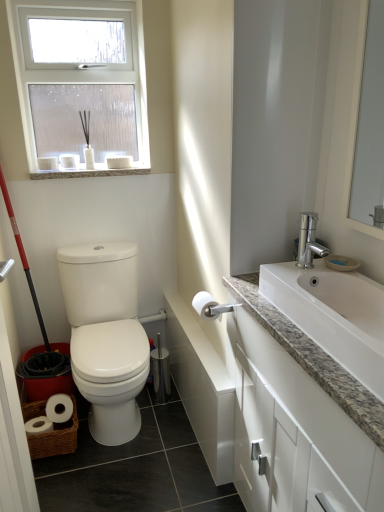
The height and width of the screenshot is (512, 384). Describe the element at coordinates (81, 68) in the screenshot. I see `white frosted glass window at upper left` at that location.

This screenshot has height=512, width=384. Describe the element at coordinates (331, 308) in the screenshot. I see `white granite sink at right` at that location.

In order to face white granite countertop at right, should I rotate leftwards or rightwards?

To align with it, rotate right about 17.324°.

You are a GUI agent. You are given a task and a screenshot of the screen. Output one action in this format:
    pyautogui.click(x=<x>, y=<y>)
    Task: Click on the white glossy toilet at left
    
    Given the screenshot: What is the action you would take?
    pyautogui.click(x=106, y=336)

The width and height of the screenshot is (384, 512). Find the location of `white frosted glass window at upper left`. white frosted glass window at upper left is located at coordinates (81, 68).

From the image's perspective, which one is positioned lower, white glossy mirror at upper right or white granite sink at right?

white granite sink at right appears lower in the image.

Between point (358, 72) and point (373, 314), which one is positioned in front?

The point (373, 314) is in front.

Would you say white granite sink at right is part of white glossy mirror at upper right's contents?

No, white granite sink at right is located outside of white glossy mirror at upper right.

Considering the relative sizes of white glossy mirror at upper right and white granite sink at right in the image provided, is white glossy mirror at upper right taller than white granite sink at right?

Yes, white glossy mirror at upper right is taller than white granite sink at right.

From a real-world perspective, is white glossy mirror at upper right under red plastic screen door at left?

Incorrect, from a real-world perspective, white glossy mirror at upper right is higher than red plastic screen door at left.

Does white glossy mirror at upper right have a larger size compared to red plastic screen door at left?

No, white glossy mirror at upper right is not bigger than red plastic screen door at left.

Where is `screen door below the white glossy mirror at upper right (from the image's perspective)`? screen door below the white glossy mirror at upper right (from the image's perspective) is located at coordinates (13, 438).

Does white glossy toilet at left appear on the right side of granite at upper left?

Correct, you'll find white glossy toilet at left to the right of granite at upper left.

Which of these two, white glossy toilet at left or granite at upper left, is smaller?

granite at upper left.

From the image's perspective, is white glossy toilet at left above granite at upper left?

Actually, white glossy toilet at left appears below granite at upper left in the image.

Is white granite countertop at right to the right of white matte toilet paper at upper right from the viewer's perspective?

Yes.

From the image's perspective, who appears lower, white granite countertop at right or white matte toilet paper at upper right?

white granite countertop at right appears lower in the image.

Is white granite countertop at right turned away from white matte toilet paper at upper right?

No.

Can you confirm if white granite countertop at right is bigger than white matte toilet paper at upper right?

Correct, white granite countertop at right is larger in size than white matte toilet paper at upper right.

From the image's perspective, would you say granite at upper left is positioned over white glossy toilet at left?

Yes, from the image's perspective, granite at upper left is above white glossy toilet at left.

Is white glossy toilet at left at the back of granite at upper left?

granite at upper left does not have its back to white glossy toilet at left.

Which is less distant, (143, 170) or (129, 310)?

Positioned in front is point (129, 310).

Is white glossy toilet at left oriented away from white granite sink at right?

No.

Relative to white granite sink at right, is white glossy toilet at left in front or behind?

white glossy toilet at left is positioned farther from the viewer than white granite sink at right.

Can you tell me how much white glossy toilet at left and white granite sink at right differ in facing direction?

white glossy toilet at left and white granite sink at right are facing 92.4 degrees away from each other.

Does white matte toilet paper at upper right touch white granite sink at right?

No, white matte toilet paper at upper right is not with white granite sink at right.

From a real-world perspective, does white matte toilet paper at upper right sit lower than white granite sink at right?

Correct, in the physical world, white matte toilet paper at upper right is lower than white granite sink at right.

Is white matte toilet paper at upper right positioned with its back to white granite sink at right?

That's not correct — white matte toilet paper at upper right is not looking away from white granite sink at right.

Locate an element on the screen. The height and width of the screenshot is (512, 384). toilet paper lying below the white granite sink at right (from the image's perspective) is located at coordinates (205, 305).

The image size is (384, 512). What are the coordinates of `mirror behind the white granite sink at right` in the screenshot? It's located at (368, 129).

Find the location of a particular element. The image size is (384, 512). mirror on the right of red plastic screen door at left is located at coordinates (368, 129).

Based on their spatial positions, is white granite countertop at right or white glossy toilet paper at center further from granite at upper left?

white granite countertop at right is further to granite at upper left.

When comparing their distances from white granite sink at right, does white frosted glass window at upper left or white matte toilet paper at upper right seem further?

Among the two, white frosted glass window at upper left is located further to white granite sink at right.

When comparing their distances from white glossy mirror at upper right, does red plastic screen door at left or white granite countertop at right seem further?

The object further to white glossy mirror at upper right is red plastic screen door at left.

Considering their positions, is white matte toilet paper at upper right positioned closer to white granite countertop at right than white frosted glass window at upper left?

white matte toilet paper at upper right lies closer to white granite countertop at right than the other object.

Which object lies further to the anchor point white matte toilet paper at upper right, red plastic screen door at left or white granite sink at right?

The object further to white matte toilet paper at upper right is red plastic screen door at left.

Considering their positions, is white matte toilet paper at upper right positioned closer to granite at upper left than white glossy toilet paper at center?

The object closer to granite at upper left is white matte toilet paper at upper right.

Estimate the real-world distances between objects in this image. Which object is further from white granite sink at right, woven brown basket at lower left or white glossy mirror at upper right?

The object further to white granite sink at right is woven brown basket at lower left.

Estimate the real-world distances between objects in this image. Which object is further from white granite countertop at right, red plastic screen door at left or woven brown basket at lower left?

woven brown basket at lower left.

I want to click on toilet positioned between red plastic screen door at left and white frosted glass window at upper left from near to far, so click(106, 336).

Locate an element on the screen. The height and width of the screenshot is (512, 384). toilet paper between white granite countertop at right and white glossy toilet paper at center along the z-axis is located at coordinates (205, 305).

At what (x,y) coordinates should I click in order to perform the action: click on toilet paper located between granite at upper left and white glossy mirror at upper right in the left-right direction. Please return your answer as a coordinate pair (x, y). Looking at the image, I should click on (205, 305).

I want to click on mirror between white frosted glass window at upper left and woven brown basket at lower left in the up-down direction, so click(368, 129).